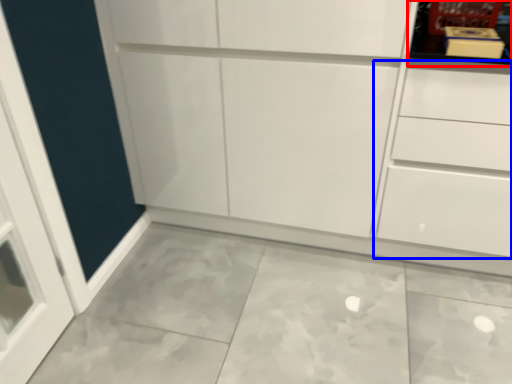
Question: Among these objects, which one is nearest to the camera, shelf (highlighted by a red box) or drawer (highlighted by a blue box)?

Choices:
 (A) shelf
 (B) drawer

Answer: (B)